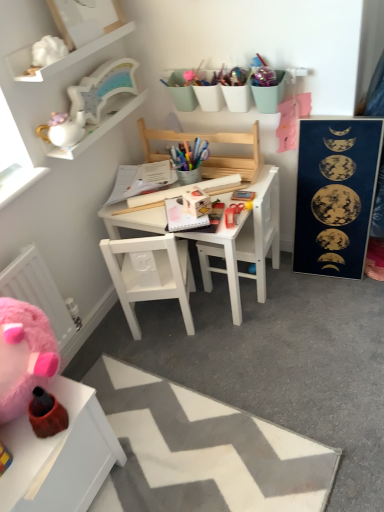
Image resolution: width=384 pixels, height=512 pixels. Find the location of `vacant region to the left of blue matte poster at right`. vacant region to the left of blue matte poster at right is located at coordinates (289, 287).